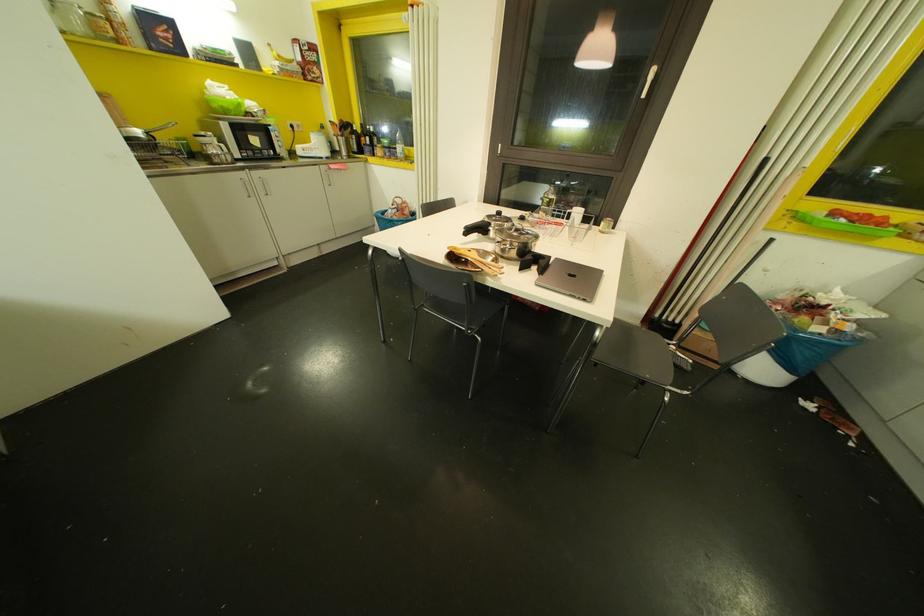
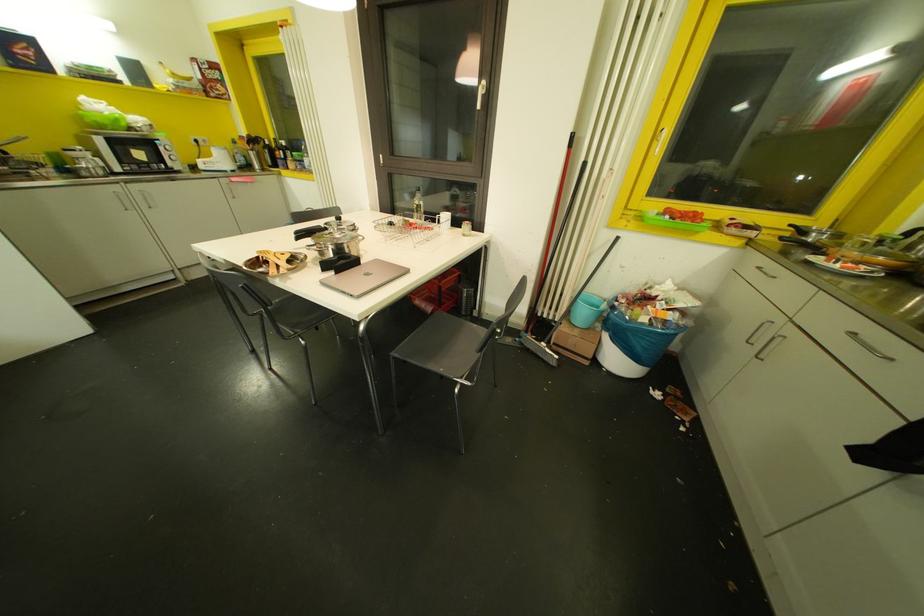
Question: How did the camera likely rotate?

Choices:
 (A) Left
 (B) Right
 (C) Up
 (D) Down

Answer: (D)